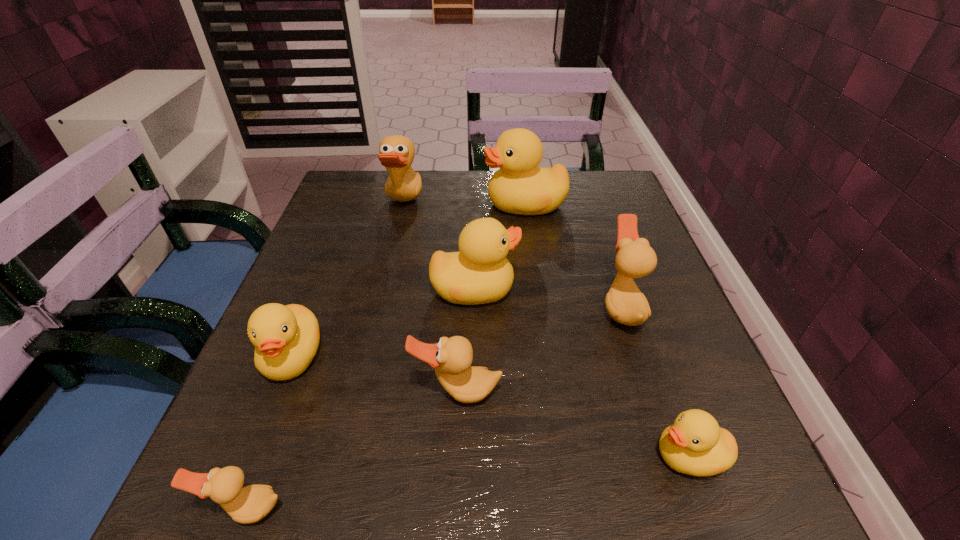
Identify the location of vacant space located 0.350m on the beak of the third smallest tan duck. The width and height of the screenshot is (960, 540). (423, 307).

The image size is (960, 540). I want to click on free space located on the beak of the third smallest tan duck, so click(535, 307).

At what (x,y) coordinates should I click in order to perform the action: click on free space located 0.080m at the beak of the leftmost yellow duck. Please return your answer as a coordinate pair (x, y). The image size is (960, 540). Looking at the image, I should click on (261, 437).

Find the location of a particular element. The height and width of the screenshot is (540, 960). vacant space located 0.090m on the beak of the third farthest tan duck is located at coordinates (454, 465).

The width and height of the screenshot is (960, 540). Identify the location of blank space located at the beak of the seventh farthest object. (612, 456).

Where is `free spot located 0.220m at the beak of the seventh farthest object`? The height and width of the screenshot is (540, 960). free spot located 0.220m at the beak of the seventh farthest object is located at coordinates (502, 456).

Find the location of `free location located at the beak of the seventh farthest object`. free location located at the beak of the seventh farthest object is located at coordinates (393, 456).

This screenshot has height=540, width=960. What are the coordinates of `object that is at the far left corner` in the screenshot? It's located at (396, 153).

Identify the location of object located at the near left corner. (250, 504).

What are the coordinates of `object located in the near right corner section of the desktop` in the screenshot? It's located at (695, 445).